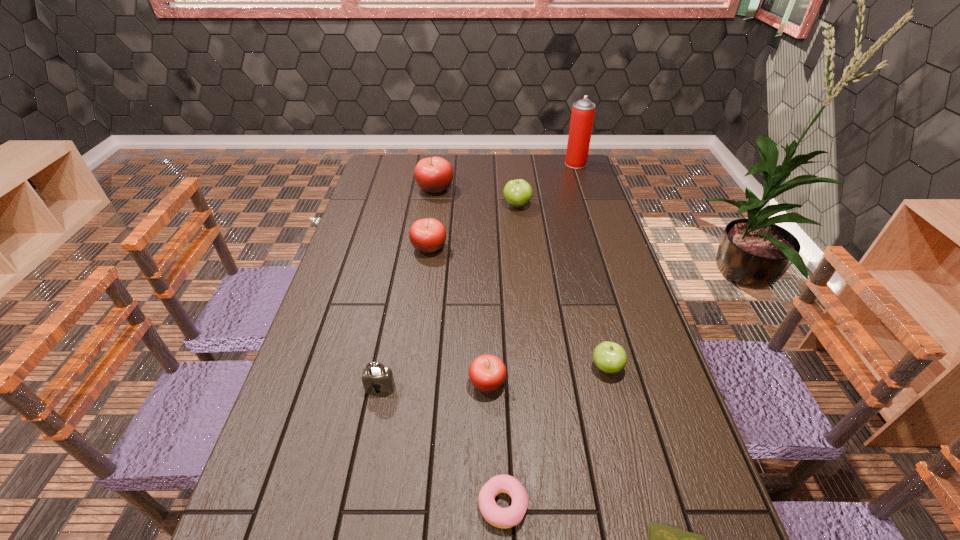
Point out which object is positioned as the sixth nearest to the smallest red apple. Please provide its 2D coordinates. Your answer should be formatted as a tuple, i.e. [(x, y)], where the tuple contains the x and y coordinates of a point satisfying the conditions above.

[(517, 193)]

Identify which object is the third closest to the aerosol can. Please provide its 2D coordinates. Your answer should be formatted as a tuple, i.e. [(x, y)], where the tuple contains the x and y coordinates of a point satisfying the conditions above.

[(428, 235)]

Locate which apple is the second closest to the padlock. Please provide its 2D coordinates. Your answer should be formatted as a tuple, i.e. [(x, y)], where the tuple contains the x and y coordinates of a point satisfying the conditions above.

[(428, 235)]

The width and height of the screenshot is (960, 540). Find the location of `apple that is the closest to the right green apple`. apple that is the closest to the right green apple is located at coordinates (487, 373).

The image size is (960, 540). What are the coordinates of `red apple that is the nearest to the farthest red apple` in the screenshot? It's located at (428, 235).

I want to click on the closest red apple to the pink doughnut, so click(487, 373).

Identify the location of vacant space that satisfies the following two spatial constraints: 1. on the back side of the smallest red apple; 2. on the right side of the red aerosol can. The height and width of the screenshot is (540, 960). (484, 164).